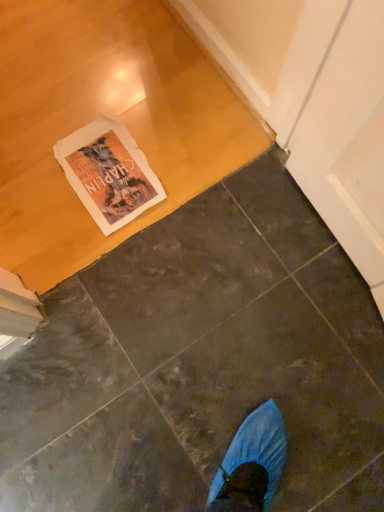
The image size is (384, 512). Find the location of `free point in front of white paper magazine at upper left`. free point in front of white paper magazine at upper left is located at coordinates (98, 265).